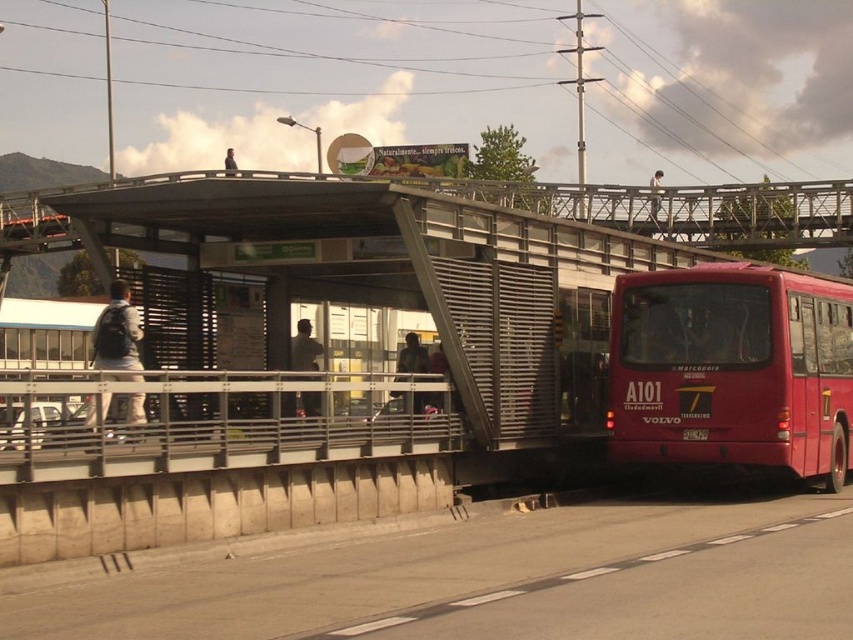
Question: Which object is the closest to the dark gray jacket at center?

Choices:
 (A) red matte bus at right
 (B) white fabric backpack at left

Answer: (B)

Question: Is red matte bus at right closer to camera compared to dark gray jacket at center?

Choices:
 (A) yes
 (B) no

Answer: (A)

Question: Which object is farther from the camera taking this photo?

Choices:
 (A) red matte bus at right
 (B) light brown wooden pole at upper center
 (C) dark gray jacket at center
 (D) dark gray metallic statue at center

Answer: (B)

Question: Does white fabric backpack at left have a larger size compared to dark gray jacket at upper center?

Choices:
 (A) yes
 (B) no

Answer: (B)

Question: Can you confirm if dark gray jacket at center is positioned to the left of light brown wooden pole at upper center?

Choices:
 (A) yes
 (B) no

Answer: (A)

Question: Which of the following is the farthest from the observer?

Choices:
 (A) dark gray jacket at center
 (B) dark gray metallic statue at center

Answer: (A)